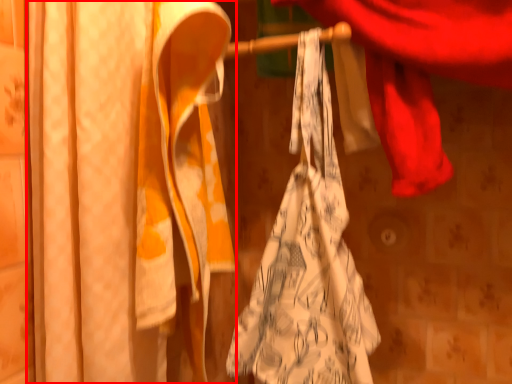
Question: From the image, what is the correct spatial relationship of curtain (annotated by the red box) in relation to towel?

Choices:
 (A) right
 (B) left

Answer: (B)